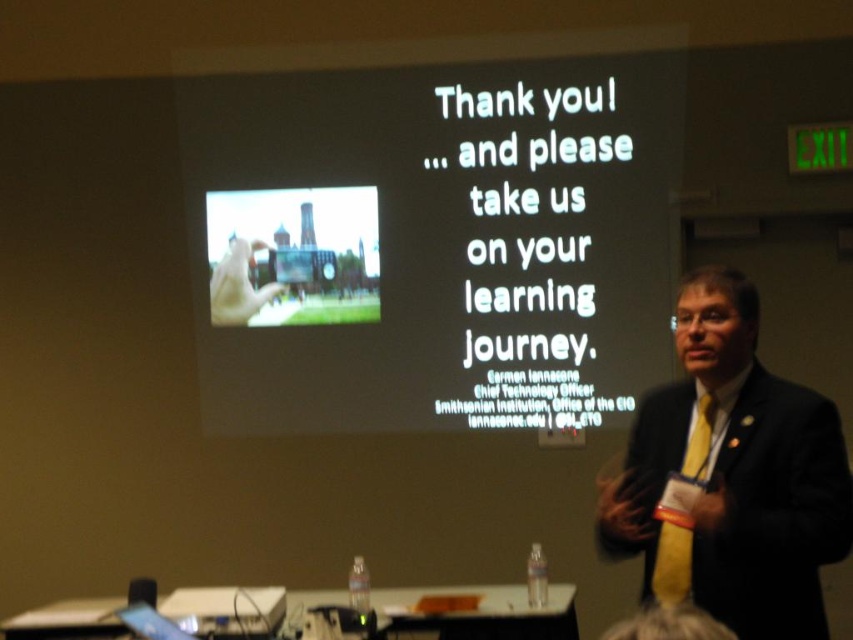
What do you see at coordinates (431, 234) in the screenshot? I see `white matte projector screen at upper center` at bounding box center [431, 234].

Image resolution: width=853 pixels, height=640 pixels. What are the coordinates of `white matte projector screen at upper center` in the screenshot? It's located at (431, 234).

Is black suit at center above yellowtextured fabrictie at right?

Indeed, black suit at center is positioned over yellowtextured fabrictie at right.

Which is more to the left, black suit at center or yellowtextured fabrictie at right?

yellowtextured fabrictie at right

Does point (776, 632) come farther from viewer compared to point (659, 593)?

No, it is not.

I want to click on black suit at center, so click(732, 476).

Is white matte projector screen at upper center below black suit at center?

No.

Which is more to the left, white matte projector screen at upper center or black suit at center?

Positioned to the left is white matte projector screen at upper center.

What do you see at coordinates (431, 234) in the screenshot? Image resolution: width=853 pixels, height=640 pixels. I see `white matte projector screen at upper center` at bounding box center [431, 234].

Locate an element on the screen. This screenshot has width=853, height=640. white matte projector screen at upper center is located at coordinates (431, 234).